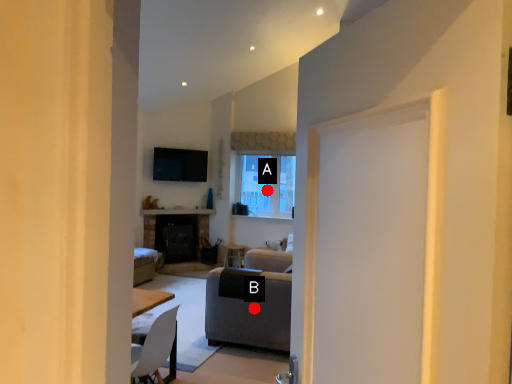
Question: Two points are circled on the image, labeled by A and B beside each circle. Which of the following is the closest to the observer?

Choices:
 (A) A is closer
 (B) B is closer

Answer: (B)